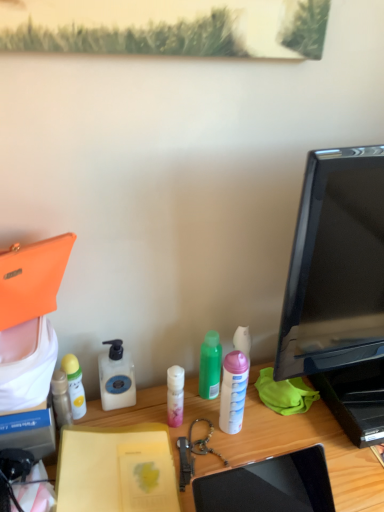
Find the location of `vacant space to the left of white matte spray can at center, the 1th bottle from the right`. vacant space to the left of white matte spray can at center, the 1th bottle from the right is located at coordinates (157, 422).